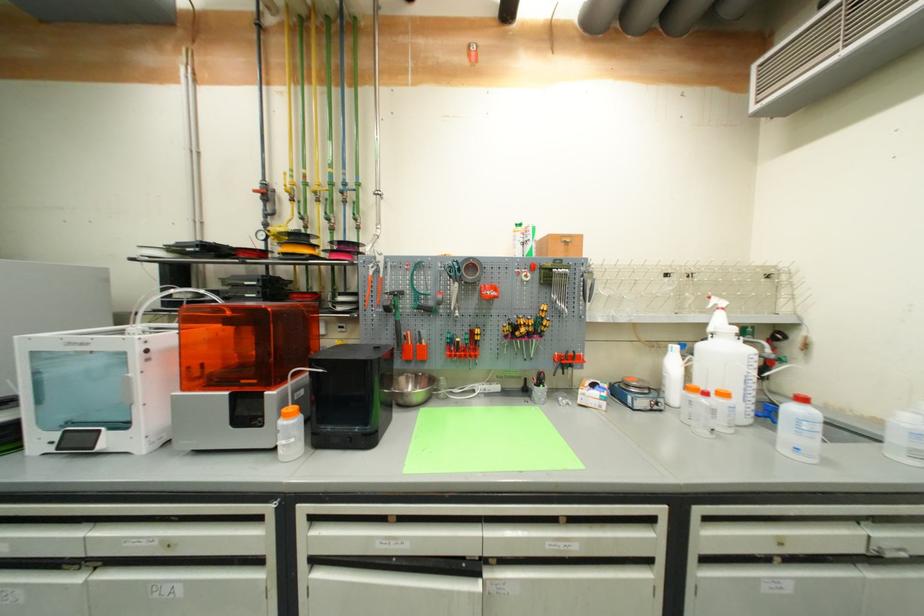
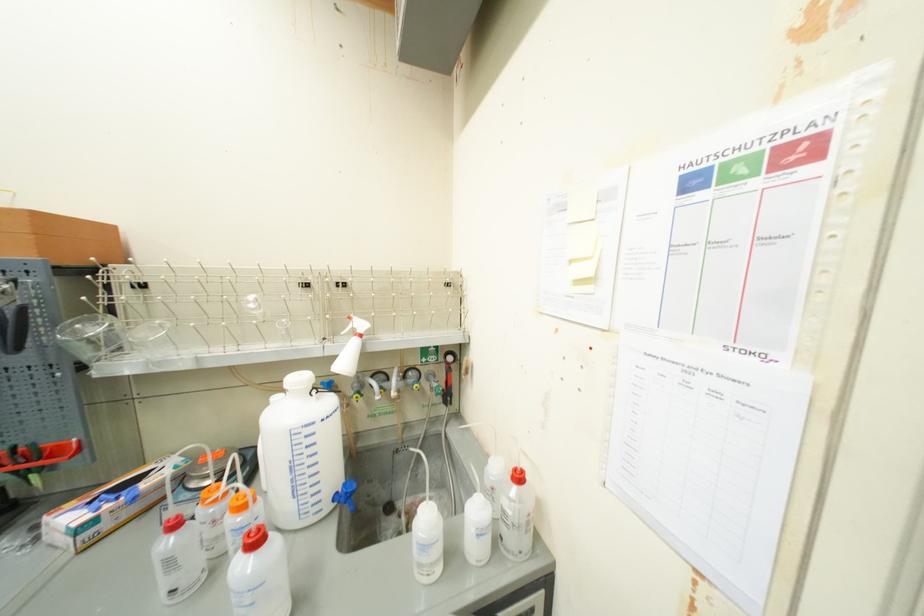
Locate, in the second image, the point that corresponds to point 745,341 in the first image.

(317, 398)